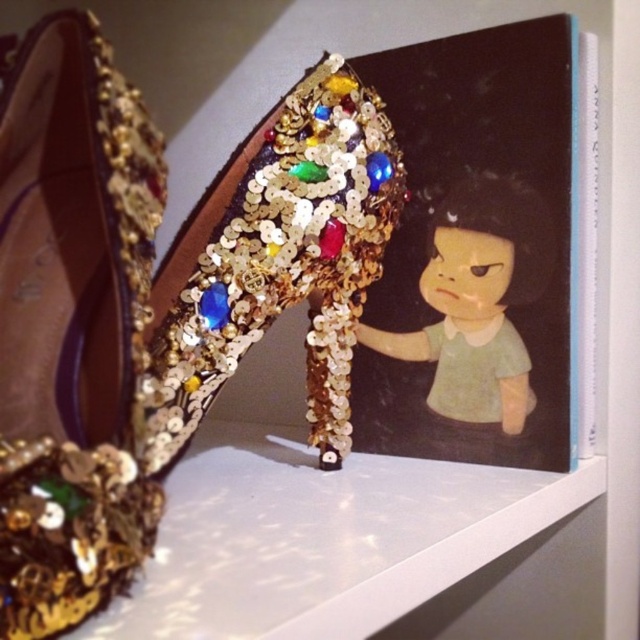
Describe the element at coordinates (72, 324) in the screenshot. The height and width of the screenshot is (640, 640). I see `gold sequined shoe at upper left` at that location.

Looking at this image, can you confirm if gold sequined shoe at upper left is positioned below gold sequined heel at center?

No.

Who is more distant from viewer, (90, 577) or (324, 456)?

Point (324, 456)

Where is `gold sequined shoe at upper left`? gold sequined shoe at upper left is located at coordinates (72, 324).

Is gold sequined shoe at upper left to the left of matte plastic doll at upper right from the viewer's perspective?

Indeed, gold sequined shoe at upper left is positioned on the left side of matte plastic doll at upper right.

Find the location of a particular element. The height and width of the screenshot is (640, 640). gold sequined shoe at upper left is located at coordinates (72, 324).

Can you confirm if matte plastic doll at upper right is positioned below gold sequined heel at center?

Incorrect, matte plastic doll at upper right is not positioned below gold sequined heel at center.

Who is lower down, matte plastic doll at upper right or gold sequined heel at center?

Positioned lower is gold sequined heel at center.

Describe the element at coordinates (467, 326) in the screenshot. I see `matte plastic doll at upper right` at that location.

Locate an element on the screen. matte plastic doll at upper right is located at coordinates (467, 326).